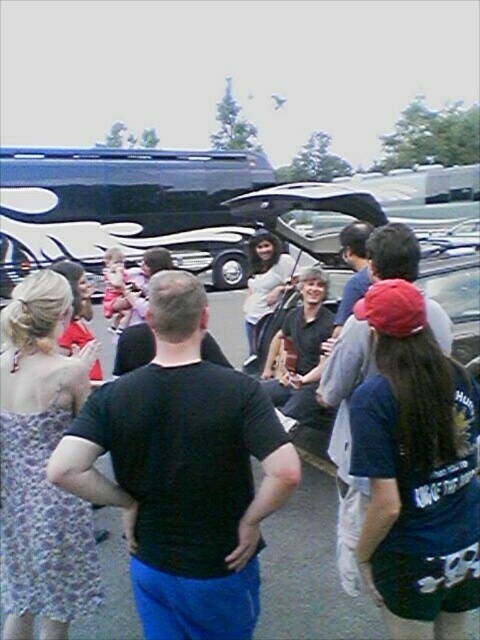
Question: Which object appears farthest from the camera in this image?

Choices:
 (A) black matte shirt at center
 (B) dark blue fabric shirt at center

Answer: (B)

Question: Can you confirm if black matte shirt at center is positioned above dark blue fabric shirt at center?

Choices:
 (A) no
 (B) yes

Answer: (B)

Question: Can you confirm if black matte shirt at center is wider than dark blue fabric shirt at center?

Choices:
 (A) yes
 (B) no

Answer: (A)

Question: Which point is farther from the camera taking this photo?

Choices:
 (A) (278, 452)
 (B) (416, 371)

Answer: (B)

Question: Can you confirm if black matte shirt at center is positioned above dark blue fabric shirt at center?

Choices:
 (A) no
 (B) yes

Answer: (B)